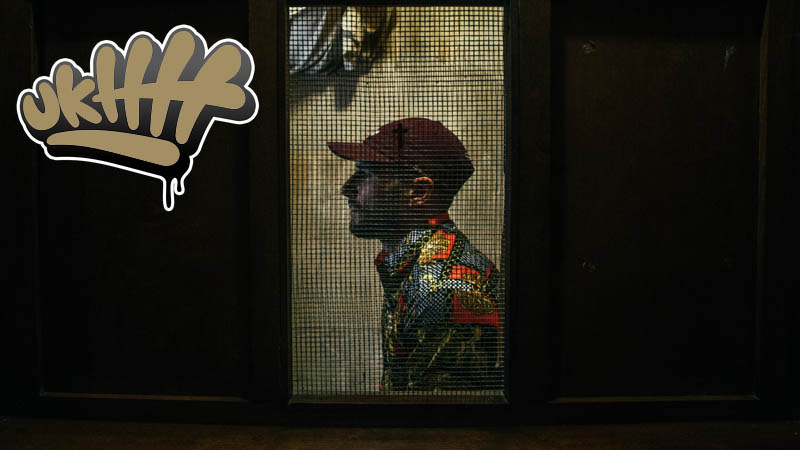
Identify the location of drawer. This screenshot has height=450, width=800. (658, 211).